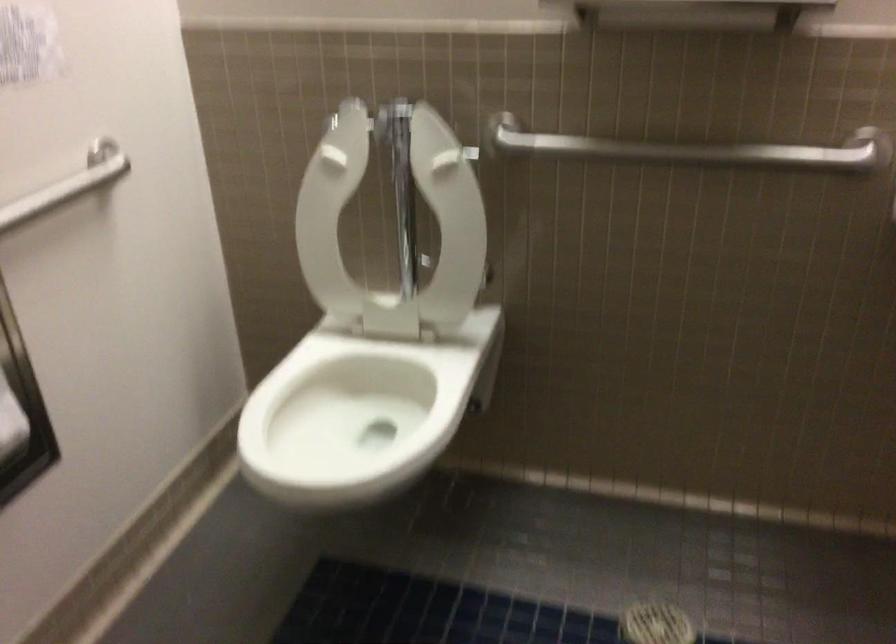
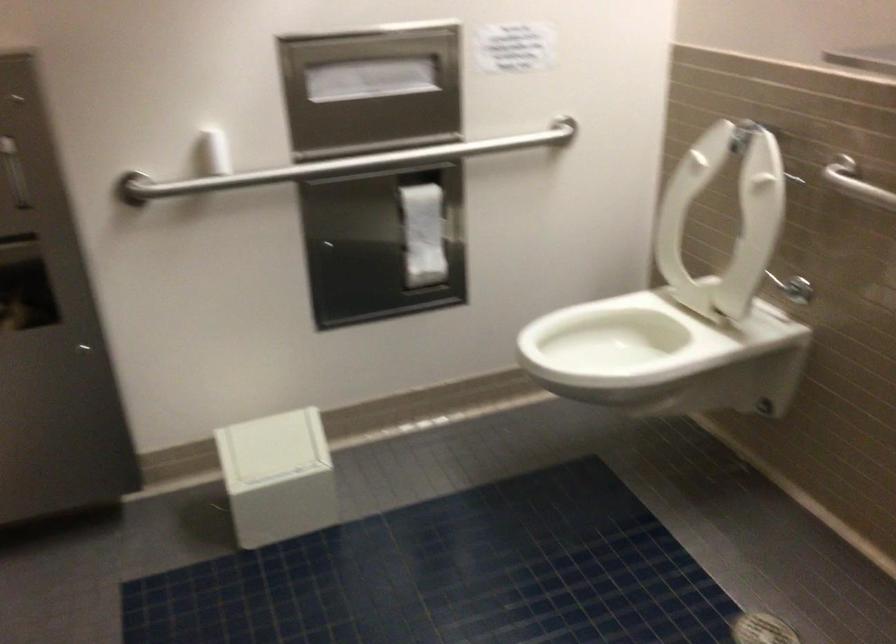
Where in the second image is the point corresponding to point 346,223 from the first image?

(724, 219)